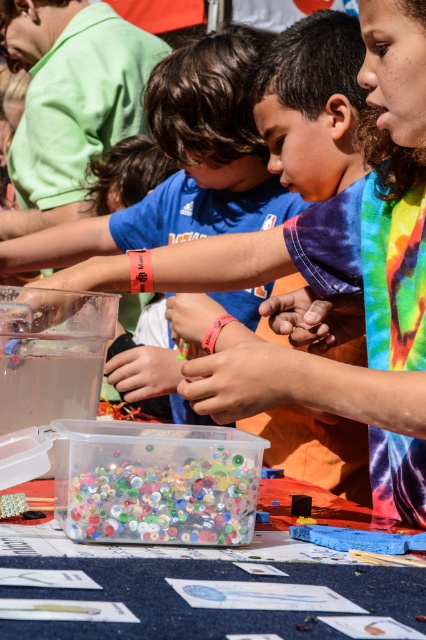
Question: Can you confirm if brown leather hand at center is positioned to the right of matte plastic hand at center?

Choices:
 (A) yes
 (B) no

Answer: (A)

Question: Which object appears closest to the camera in this image?

Choices:
 (A) matte plastic hand at center
 (B) rubber band at center

Answer: (B)

Question: Which object appears closest to the camera in this image?

Choices:
 (A) matte plastic hand at center
 (B) brown leather hand at center
 (C) smooth skin at center

Answer: (C)

Question: Which object appears closest to the camera in this image?

Choices:
 (A) brown leather hand at center
 (B) matte plastic hand at center
 (C) smooth skin at center
 (D) translucent plastic container at lower center

Answer: (D)

Question: Can you confirm if brown leather hand at center is smaller than rubber band at center?

Choices:
 (A) yes
 (B) no

Answer: (A)

Question: Can you confirm if translucent plastic container at center is positioned above translucent plastic hand at lower left?

Choices:
 (A) yes
 (B) no

Answer: (B)